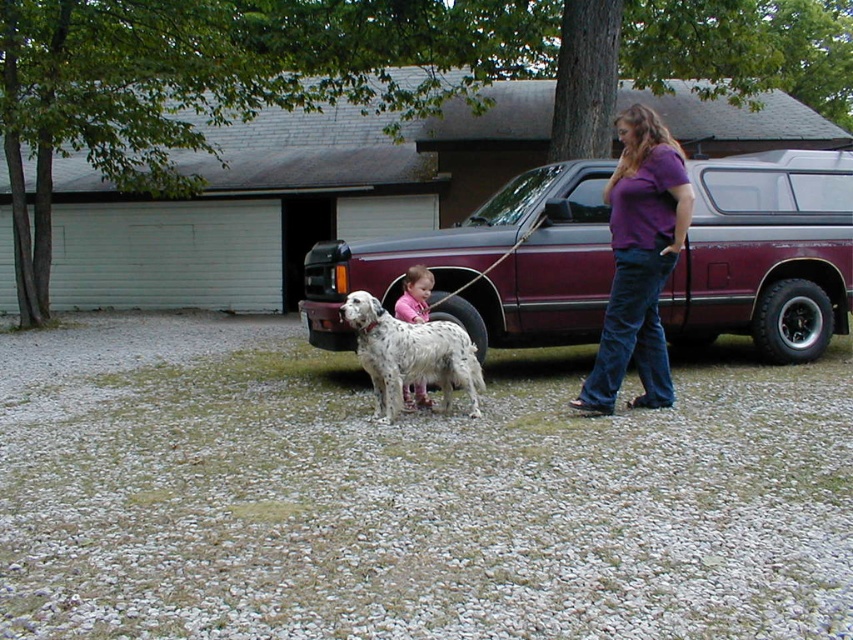
Does white speckled fur dog at center have a smaller size compared to pink fabric at center?

No, white speckled fur dog at center is not smaller than pink fabric at center.

Does white speckled fur dog at center lie behind pink fabric at center?

No, white speckled fur dog at center is in front of pink fabric at center.

Identify the location of white speckled fur dog at center. (410, 355).

Where is `white speckled fur dog at center`? The height and width of the screenshot is (640, 853). white speckled fur dog at center is located at coordinates (410, 355).

Does purple cotton shirt at right appear on the left side of white speckled fur dog at center?

In fact, purple cotton shirt at right is to the right of white speckled fur dog at center.

Is purple cotton shirt at right smaller than white speckled fur dog at center?

No, purple cotton shirt at right is not smaller than white speckled fur dog at center.

Which is behind, point (618, 352) or point (346, 301)?

Positioned behind is point (346, 301).

You are a GUI agent. You are given a task and a screenshot of the screen. Output one action in this format:
    pyautogui.click(x=<x>, y=<y>)
    Task: Click on the purple cotton shirt at right
    
    Given the screenshot: What is the action you would take?
    pyautogui.click(x=639, y=260)

Is the position of purple cotton shirt at right less distant than that of pink fabric at center?

Yes, purple cotton shirt at right is in front of pink fabric at center.

At what (x,y) coordinates should I click in order to perform the action: click on purple cotton shirt at right. Please return your answer as a coordinate pair (x, y). This screenshot has height=640, width=853. Looking at the image, I should click on (639, 260).

The width and height of the screenshot is (853, 640). Describe the element at coordinates (639, 260) in the screenshot. I see `purple cotton shirt at right` at that location.

Locate an element on the screen. The image size is (853, 640). purple cotton shirt at right is located at coordinates (639, 260).